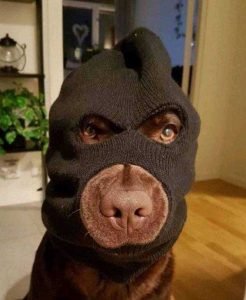
Image resolution: width=246 pixels, height=300 pixels. I want to click on plant, so click(x=27, y=130).